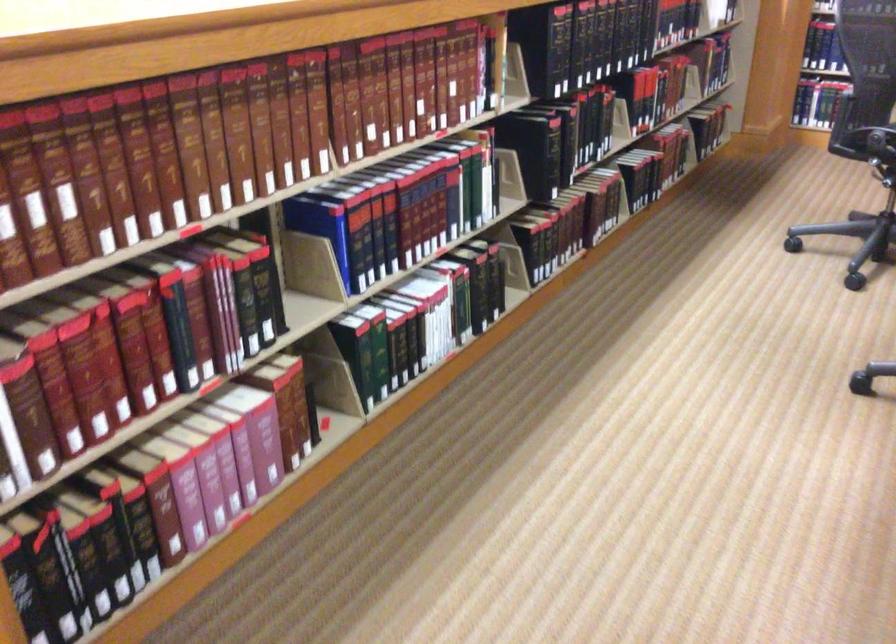
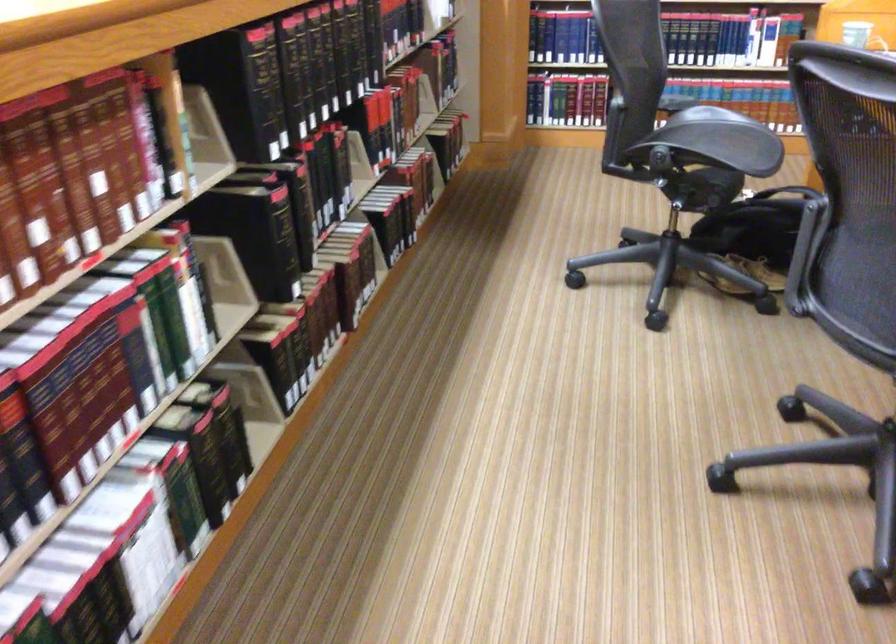
Question: Which direction would the cameraman need to move to produce the second image? Reply with the corresponding letter.

Choices:
 (A) Left
 (B) Right
 (C) Forward
 (D) Backward

Answer: (C)